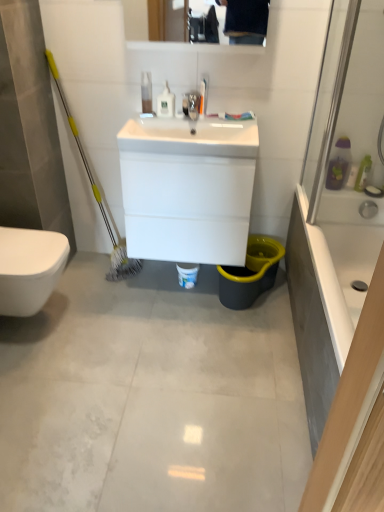
At what (x,y) coordinates should I click in order to perform the action: click on free space above gray tile floor at center (from a real-world perspective). Please return your answer as a coordinate pair (x, y). The image size is (384, 512). Looking at the image, I should click on (137, 352).